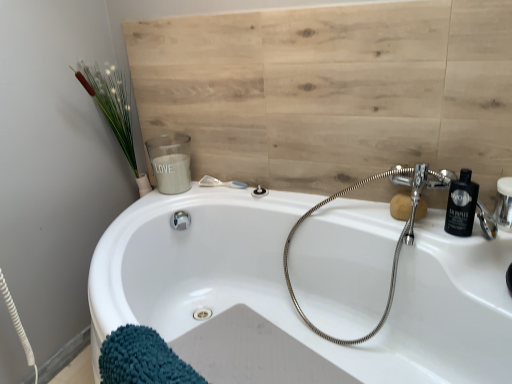
Question: Does chrome flexible hose at upper right have a greater height compared to white matte candle at upper left?

Choices:
 (A) yes
 (B) no

Answer: (A)

Question: Is chrome flexible hose at upper right not inside white matte candle at upper left?

Choices:
 (A) no
 (B) yes

Answer: (B)

Question: Considering the relative positions of chrome flexible hose at upper right and white matte candle at upper left in the image provided, is chrome flexible hose at upper right to the left of white matte candle at upper left from the viewer's perspective?

Choices:
 (A) no
 (B) yes

Answer: (A)

Question: Can you confirm if chrome flexible hose at upper right is thinner than white matte candle at upper left?

Choices:
 (A) yes
 (B) no

Answer: (B)

Question: Is chrome flexible hose at upper right to the right of white matte candle at upper left from the viewer's perspective?

Choices:
 (A) yes
 (B) no

Answer: (A)

Question: Is chrome flexible hose at upper right with white matte candle at upper left?

Choices:
 (A) yes
 (B) no

Answer: (B)

Question: Is white matte candle at upper left facing away from matte silver shower at upper center, the second shower when ordered from left to right?

Choices:
 (A) no
 (B) yes

Answer: (A)

Question: Can you see white matte candle at upper left touching matte silver shower at upper center, marked as the first shower in a right-to-left arrangement?

Choices:
 (A) no
 (B) yes

Answer: (A)

Question: Is white matte candle at upper left positioned behind matte silver shower at upper center, marked as the first shower in a right-to-left arrangement?

Choices:
 (A) yes
 (B) no

Answer: (A)

Question: From the image's perspective, does white matte candle at upper left appear lower than matte silver shower at upper center, marked as the first shower in a right-to-left arrangement?

Choices:
 (A) yes
 (B) no

Answer: (B)

Question: Can you confirm if white matte candle at upper left is smaller than matte silver shower at upper center, marked as the first shower in a right-to-left arrangement?

Choices:
 (A) yes
 (B) no

Answer: (B)

Question: Is white matte candle at upper left located outside matte silver shower at upper center, the second shower when ordered from left to right?

Choices:
 (A) yes
 (B) no

Answer: (A)

Question: Is matte silver shower at upper center, marked as the first shower in a right-to-left arrangement, shorter than chrome flexible hose at upper right?

Choices:
 (A) yes
 (B) no

Answer: (A)